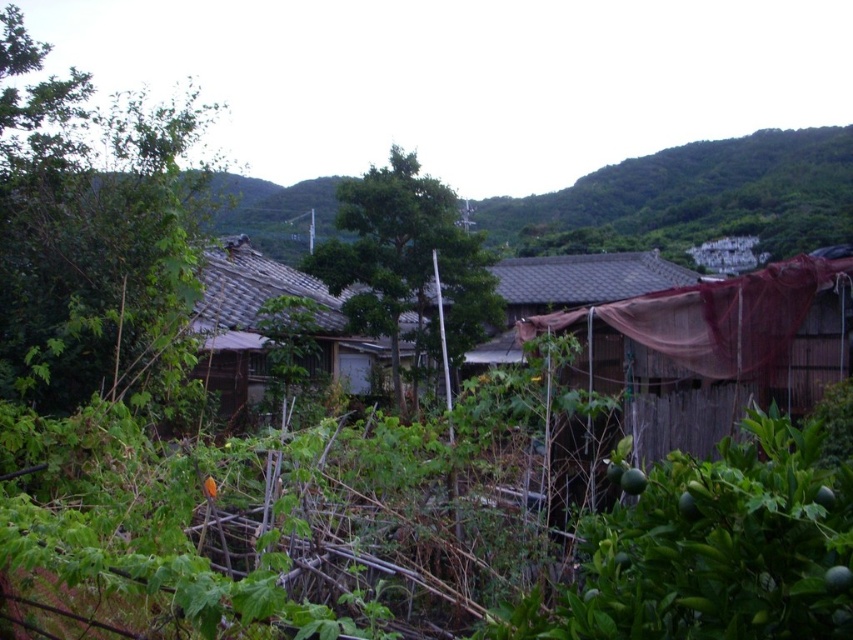
You are standing in the rural scene and want to walk from point A to point B. Point A is at coordinate point (486,252) and point B is at coordinate point (257,394). Which point is closer to you when you start walking?

Point A at coordinate point (486,252) is closer to you because it is further to the viewer than point B at coordinate point (257,394), meaning you can reach it sooner.

You are a hiker who wants to take shelter from the rain. You see a brown wooden hut at right and a green leafy tree at center. Which one is closer to the ground and would provide better protection from the rain?

The brown wooden hut at right is located below the green leafy tree at center, so it is closer to the ground and would provide better protection from the rain.

In the scene shown: You are standing in the rural scene and want to walk from the green leafy tree at center to the brown tile roof hut at center. Which direction should you move relative to the tree to reach the hut?

You should move away from the green leafy tree at center towards the brown tile roof hut at center because the tree is closer to you than the hut, meaning the hut is behind the tree from your perspective.